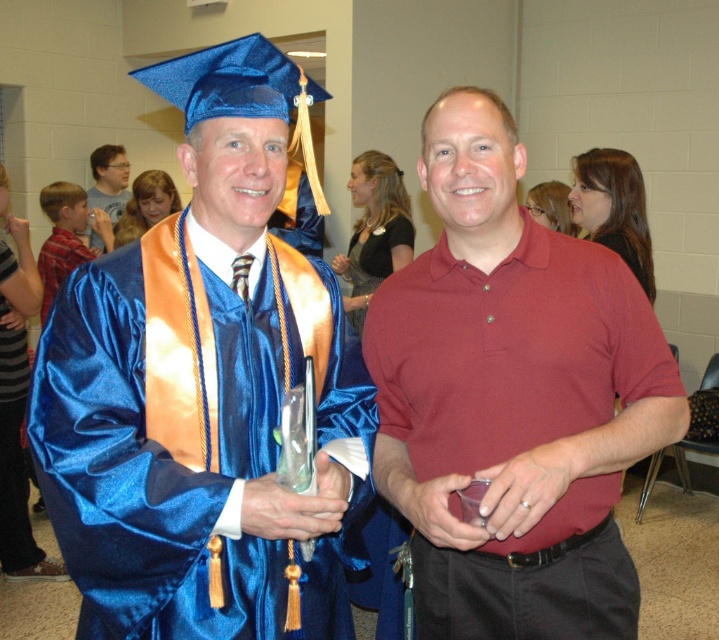
Question: Which object is closer to the camera taking this photo?

Choices:
 (A) matte plastic water bottle at left
 (B) matte red polo shirt at center
 (C) satin blue graduation gown at left

Answer: (B)

Question: Does blue satin gown at left have a larger size compared to matte plastic water bottle at left?

Choices:
 (A) no
 (B) yes

Answer: (B)

Question: Considering the real-world distances, which object is closest to the blue satin gown at left?

Choices:
 (A) matte red polo shirt at center
 (B) matte plastic water bottle at left

Answer: (B)

Question: Considering the relative positions of satin blue graduation gown at left and matte red polo shirt at center in the image provided, where is satin blue graduation gown at left located with respect to matte red polo shirt at center?

Choices:
 (A) right
 (B) left

Answer: (B)

Question: Does satin blue graduation gown at left come in front of matte plastic water bottle at left?

Choices:
 (A) yes
 (B) no

Answer: (A)

Question: Among these objects, which one is farthest from the camera?

Choices:
 (A) matte plastic water bottle at left
 (B) blue satin gown at left

Answer: (A)